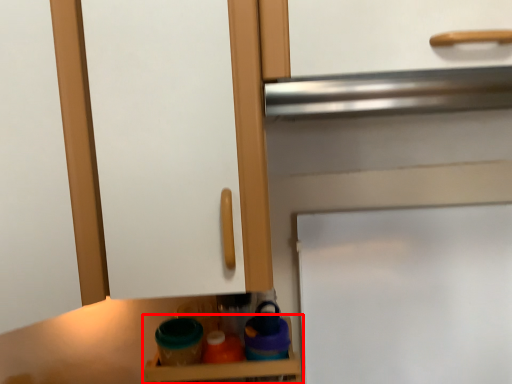
Question: From the image's perspective, what is the correct spatial relationship of shelf (annotated by the red box) in relation to door?

Choices:
 (A) below
 (B) above

Answer: (A)